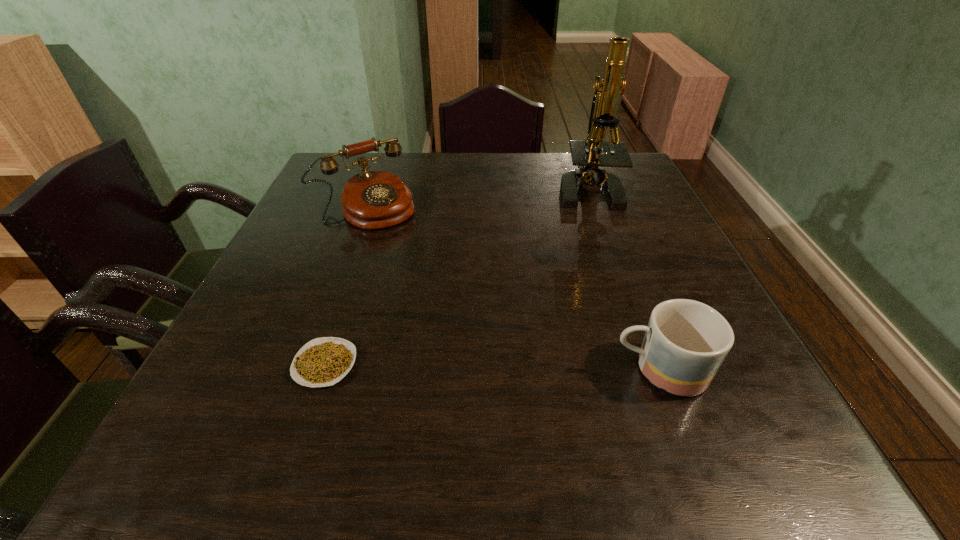
Where is `vacant space on the desktop that is between the legume and the mug and is positioned on the dial of the second tallest object`? vacant space on the desktop that is between the legume and the mug and is positioned on the dial of the second tallest object is located at coordinates (505, 368).

At what (x,y) coordinates should I click in order to perform the action: click on free spot on the desktop that is between the shortest object and the third tallest object and is positioned at the eyepiece of the microscope. Please return your answer as a coordinate pair (x, y). The height and width of the screenshot is (540, 960). Looking at the image, I should click on (459, 367).